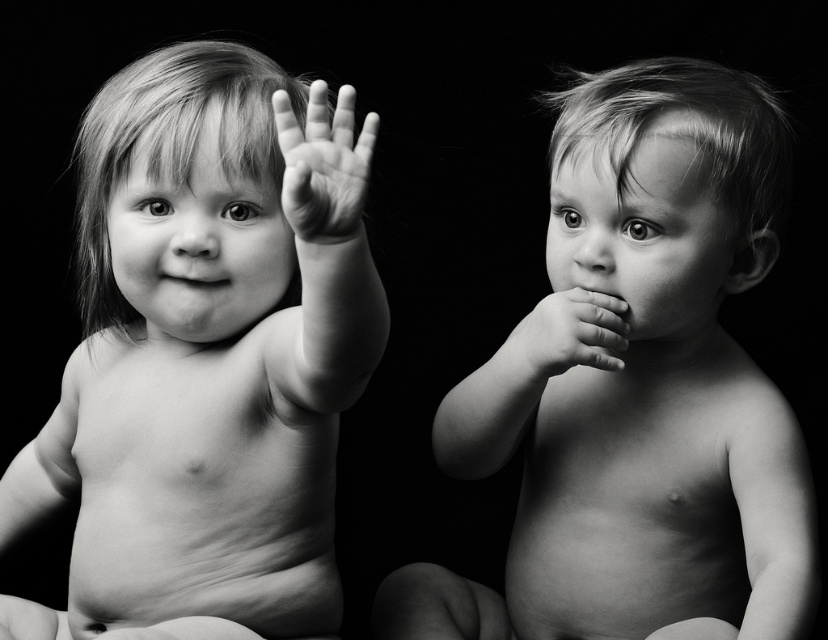
Between smooth skin hand at center and smooth matte mouth at center, which one has less height?

smooth matte mouth at center

Does point (326, 227) come behind point (191, 268)?

No, (326, 227) is closer to viewer.

You are a GUI agent. You are given a task and a screenshot of the screen. Output one action in this format:
    pyautogui.click(x=<x>, y=<y>)
    Task: Click on the smooth skin hand at center
    Image resolution: width=828 pixels, height=640 pixels.
    Given the screenshot: What is the action you would take?
    pyautogui.click(x=323, y=164)

From the picture: Between smooth skin baby at left and smooth skin hand at center, which one has more height?

smooth skin baby at left

In the scene shown: Which is more to the left, smooth skin baby at left or smooth skin hand at center?

From the viewer's perspective, smooth skin baby at left appears more on the left side.

Which is behind, point (131, 275) or point (273, 106)?

Positioned behind is point (131, 275).

This screenshot has width=828, height=640. I want to click on smooth skin baby at left, so [x=207, y=356].

Does smooth skin baby at center appear under smooth skin hand at center right?

Yes, smooth skin baby at center is below smooth skin hand at center right.

Between smooth skin baby at center and smooth skin hand at center right, which one is positioned higher?

Positioned higher is smooth skin hand at center right.

Find the location of a particular element. The height and width of the screenshot is (640, 828). smooth skin baby at center is located at coordinates [641, 392].